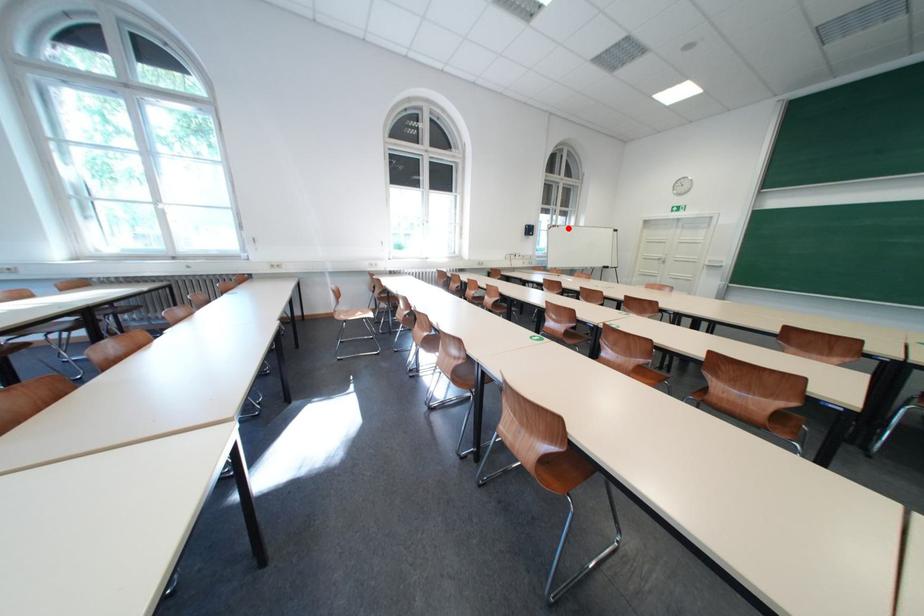
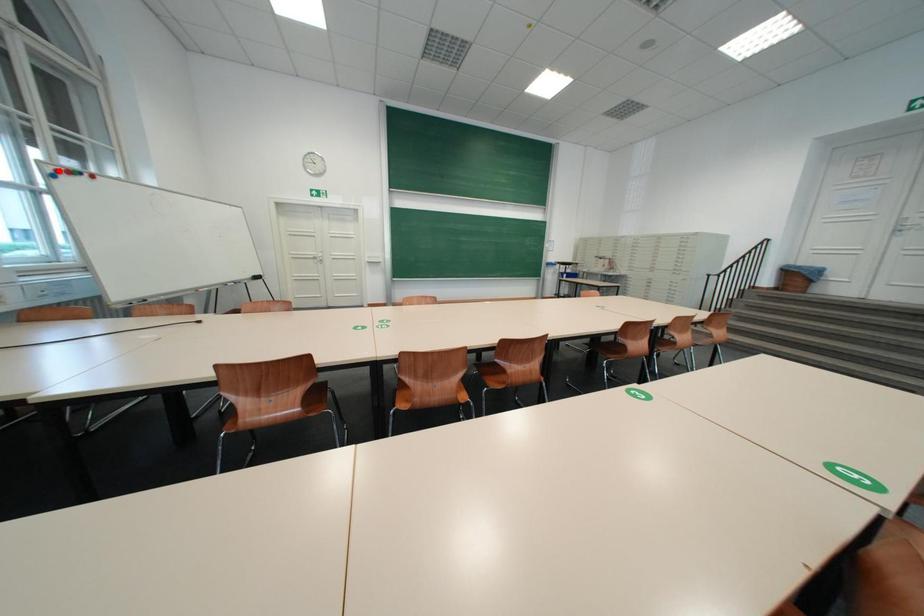
I am providing you with two images of the same scene from different viewpoints. A red point is marked on the first image and another point is marked on the second image. Is the marked point in image1 the same physical position as the marked point in image2?

No